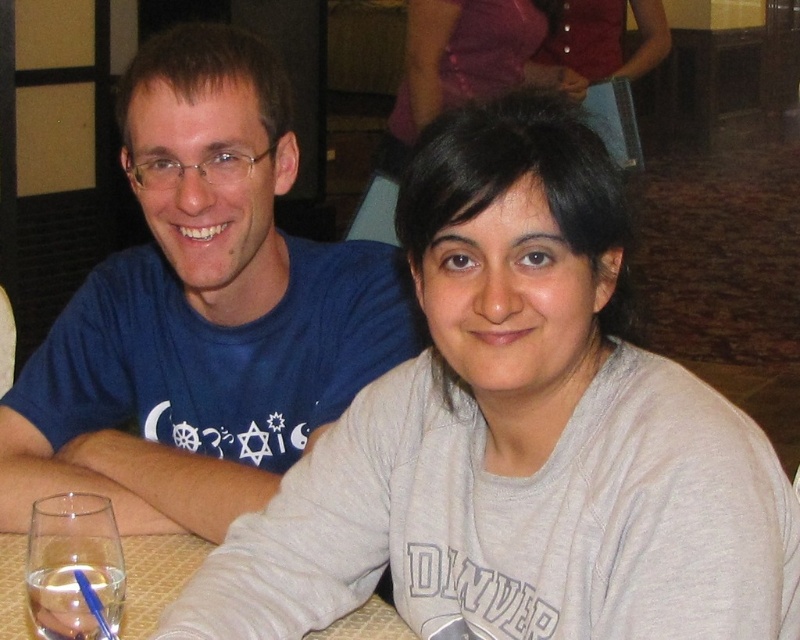
You are standing at the point labeled point (440, 529) and want to take a photo of the scene using a camera that requires you to be at least 36 inches away to focus properly. Can you take a clear photo from this position?

The distance between point (440, 529) and the camera is 36.86 inches, which is just over the minimum required distance of 36 inches. Therefore, you can take a clear photo from this position.

Consider the image. You are a photographer trying to capture a closeup of the gray cotton sweatshirt at center and the clear glass table at lower left. Which object should you focus on first to ensure it appears sharp in your photo?

The gray cotton sweatshirt at center is closer to the viewer than the clear glass table at lower left, so you should focus on the gray cotton sweatshirt at center first to ensure it appears sharp.